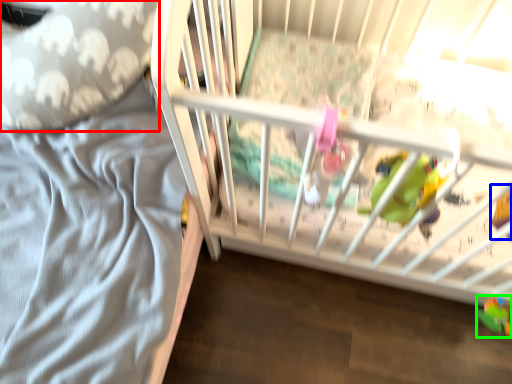
Question: Which is farther away from throw pillow (highlighted by a red box)? toy (highlighted by a blue box) or toy (highlighted by a green box)?

Choices:
 (A) toy
 (B) toy

Answer: (B)